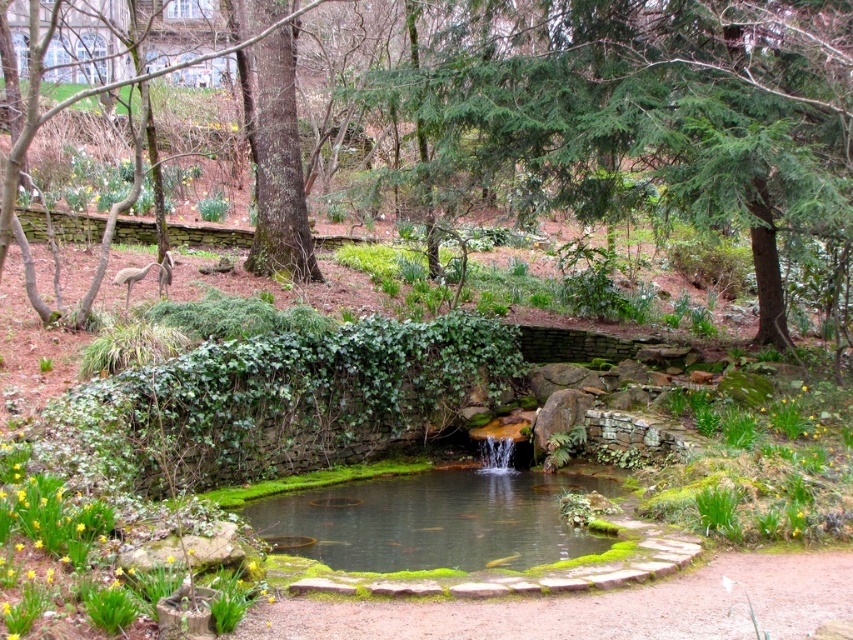
You are standing in the garden and want to take a photo of both the point at coordinates [764,38] and the point at coordinates [505,476]. Which point should you focus on first to ensure both are in sharp focus?

You should focus on the point at coordinates [764,38] first because it is closer to the camera than the point at coordinates [505,476]. This ensures the closer point is in focus, and the farther point will also be within the depth of field.

You are standing at the point labeled as point (648, 113) in the garden. What object is located exactly at your current position?

The green leafy tree at center is located exactly at point (648, 113).

You are standing at the entrance of the garden and want to locate the green leafy tree at center. According to the coordinates provided, where should you look relative to your position?

The green leafy tree at center is located at coordinates point (x=648, y=113), which would be to your lower left direction from your current position at the entrance.